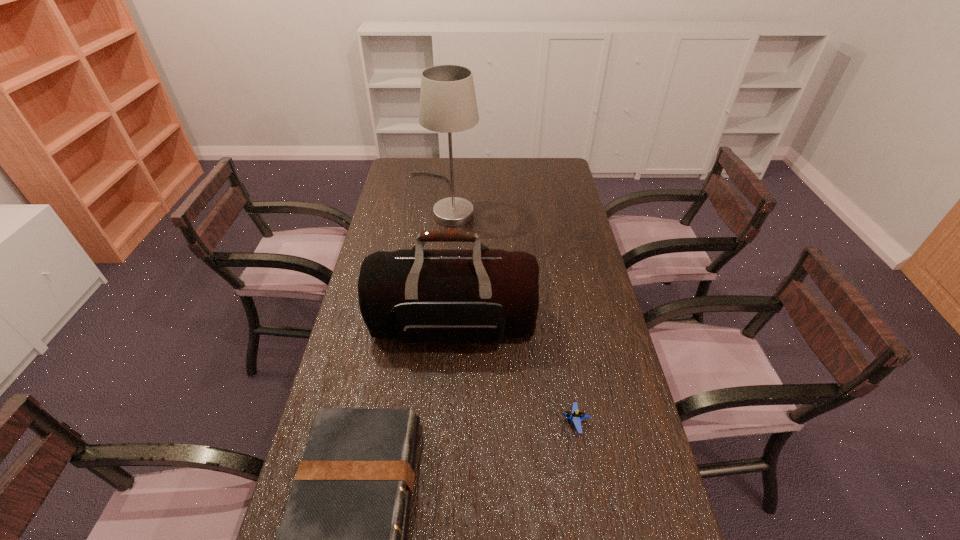
Locate an element on the screen. vacant space located 0.310m on the front-facing side of the rightmost object is located at coordinates (444, 422).

The width and height of the screenshot is (960, 540). Find the location of `object at the far edge`. object at the far edge is located at coordinates (448, 104).

Identify the location of table lamp that is at the left edge. (448, 104).

You are a GUI agent. You are given a task and a screenshot of the screen. Output one action in this format:
    pyautogui.click(x=<x>, y=<y>)
    Task: Click on the duffel bag situated at the left edge
    
    Given the screenshot: What is the action you would take?
    pyautogui.click(x=435, y=296)

Image resolution: width=960 pixels, height=540 pixels. What are the coordinates of `object located at the right edge` in the screenshot? It's located at (576, 416).

Locate an element on the screen. The height and width of the screenshot is (540, 960). object that is at the far left corner is located at coordinates (448, 104).

Image resolution: width=960 pixels, height=540 pixels. Find the location of `vacant space at the far edge`. vacant space at the far edge is located at coordinates (532, 165).

You are a GUI agent. You are given a task and a screenshot of the screen. Output one action in this format:
    pyautogui.click(x=<x>, y=<y>)
    Task: Click on the free space at the left edge
    
    Given the screenshot: What is the action you would take?
    pyautogui.click(x=380, y=242)

What are the coordinates of `vacant space at the right edge` in the screenshot? It's located at (579, 262).

The height and width of the screenshot is (540, 960). I want to click on free region at the far right corner of the desktop, so click(x=537, y=182).